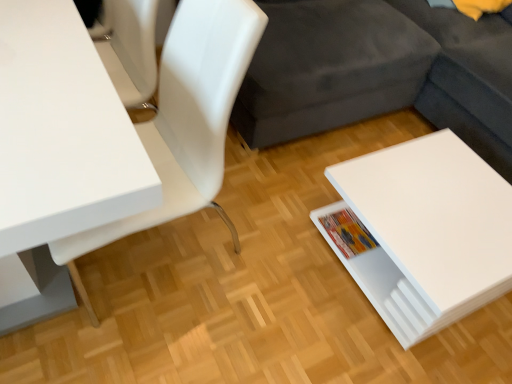
Where is `free area in between multicolored paper book at lower right and white glossy chair at upper left`? This screenshot has height=384, width=512. free area in between multicolored paper book at lower right and white glossy chair at upper left is located at coordinates (263, 243).